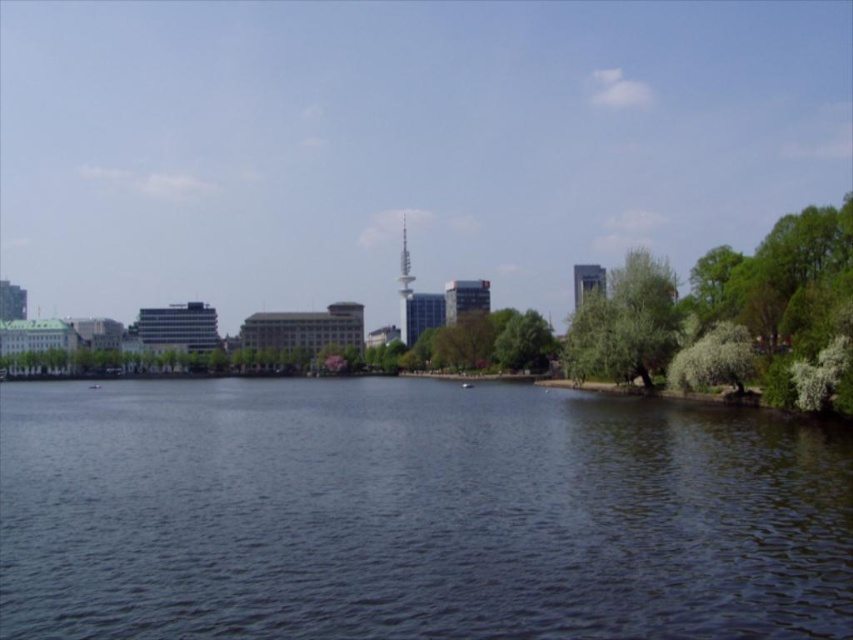
Which is more to the left, green leafy tree at right or metallic silver tower at center?

Positioned to the left is metallic silver tower at center.

Can you confirm if green leafy tree at right is positioned to the left of metallic silver tower at center?

Incorrect, green leafy tree at right is not on the left side of metallic silver tower at center.

This screenshot has width=853, height=640. Describe the element at coordinates (624, 323) in the screenshot. I see `green leafy tree at right` at that location.

At what (x,y) coordinates should I click in order to perform the action: click on green leafy tree at right. Please return your answer as a coordinate pair (x, y). The width and height of the screenshot is (853, 640). Looking at the image, I should click on (624, 323).

Can you confirm if dark blue water at center is smaller than green leafy tree at center?

Incorrect, dark blue water at center is not smaller in size than green leafy tree at center.

Which is in front, point (25, 484) or point (517, 355)?

Point (25, 484)

The image size is (853, 640). In order to click on dark blue water at center in this screenshot , I will do `click(412, 515)`.

At what (x,y) coordinates should I click in order to perform the action: click on dark blue water at center. Please return your answer as a coordinate pair (x, y). The image size is (853, 640). Looking at the image, I should click on (412, 515).

Between green leafy tree at center and metallic silver tower at center, which one is positioned higher?

metallic silver tower at center is above.

At what (x,y) coordinates should I click in order to perform the action: click on green leafy tree at center. Please return your answer as a coordinate pair (x, y). The height and width of the screenshot is (640, 853). Looking at the image, I should click on (524, 342).

Does point (526, 310) come farther from viewer compared to point (405, 330)?

That is True.

Identify the location of green leafy tree at center. (524, 342).